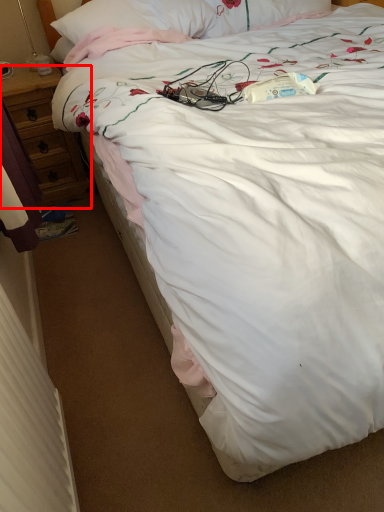
Question: In this image, where is desk (annotated by the red box) located relative to radiator?

Choices:
 (A) left
 (B) right

Answer: (A)